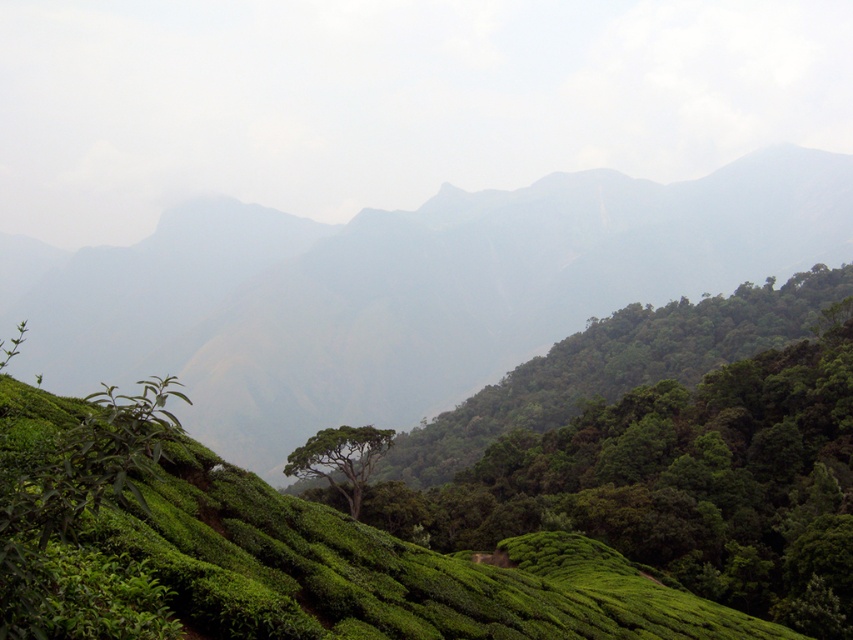
You are a hiker planning to climb the green leafy hillside at center and then reach the green leafy tree at center. Based on the scene, which direction should you go first to reach the tree after climbing the hill?

The green leafy hillside at center is above the green leafy tree at center, so after climbing the hill, you should go downward to reach the tree.

You are standing at point A located at coordinates point A at (201, 404). You want to walk to point B, which is 474.10 meters away. Is this distance within a typical walking distance for a person?

The distance between the two points is 474.10 meters, which is approximately 0.47 kilometers. A typical walking distance for a person might vary, but 474.10 meters is reasonable for a short walk, so yes, it is within typical walking distance.

You are standing at the base of the green leafy hillside at center and want to walk towards the distant mountain ranges. Which direction should you head to reach the mountains?

The green leafy hillside at center is positioned at coordinates point (401, 291), so you should head towards the background direction to reach the distant mountain ranges.